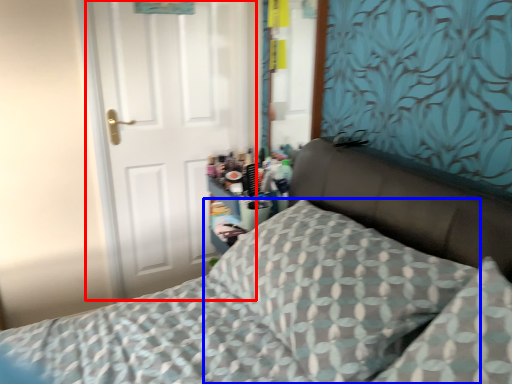
Question: Which point is closer to the camera, door (highlighted by a red box) or pillow (highlighted by a blue box)?

Choices:
 (A) door
 (B) pillow

Answer: (B)